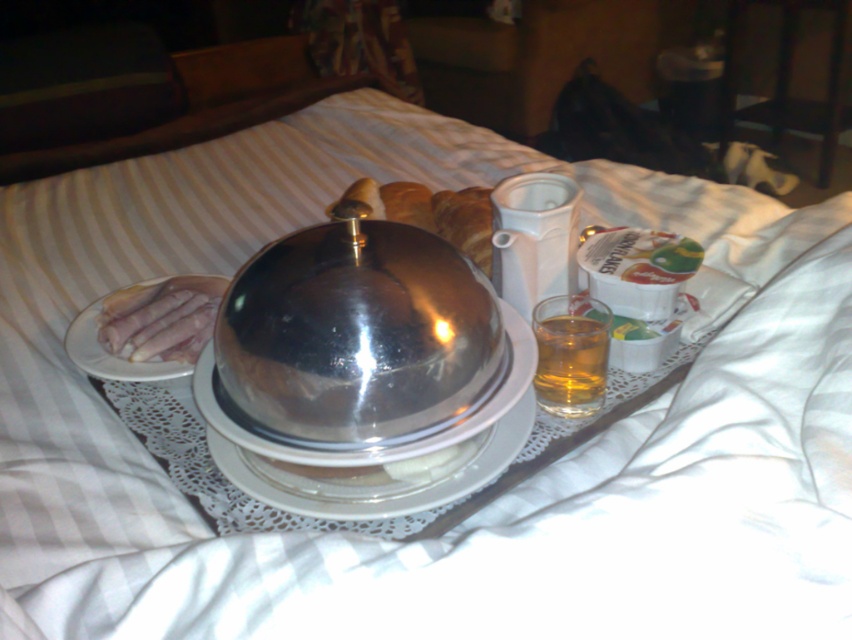
You are arranging a breakfast tray and need to place a spoon on the clear glass plate at center. However, there is a translucent glass cup at center in the way. Can you move the cup to the right to make space?

The clear glass plate at center is to the left of the translucent glass cup at center, so moving the cup to the right would create space on the left side of the cup, but the plate is already positioned to the left. Therefore, moving the cup to the right would not interfere with the plate and might allow placing the spoon on the plate without obstruction.